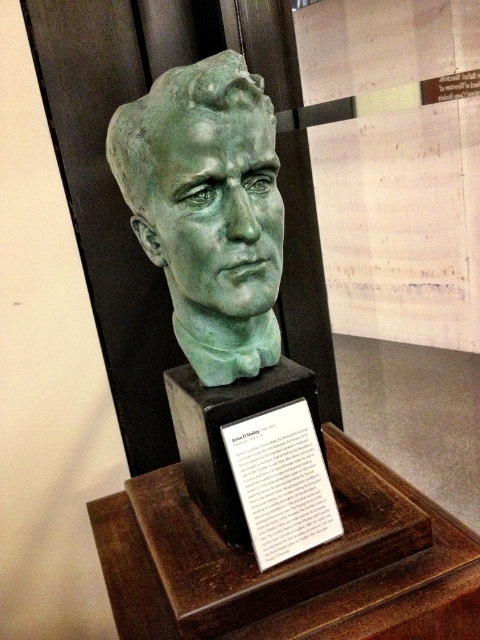
You are standing in a museum and see the green patina bust at center. If you want to read the small, white informational plaque attached to its base, which is 24 inches tall, can you reach it without moving closer than 33 inches?

The distance between you and the green patina bust at center is 33.00 inches. Since the plaque is 24 inches tall and attached to the base of the bust, you are already at the required minimum distance of 33 inches. Therefore, you can reach the plaque without moving closer.

You are an art conservator assessing the display of the green patina bust at center and the white paper at center. Which object is wider?

The green patina bust at center is wider than the white paper at center.

You are a tour guide explaining the artwork to visitors. You want to mention the size relationship between the green patina bust at center and the white paper at center. How would you describe it?

The green patina bust at center is bigger than the white paper at center, so I would mention that the bust is larger in size compared to the white paper.